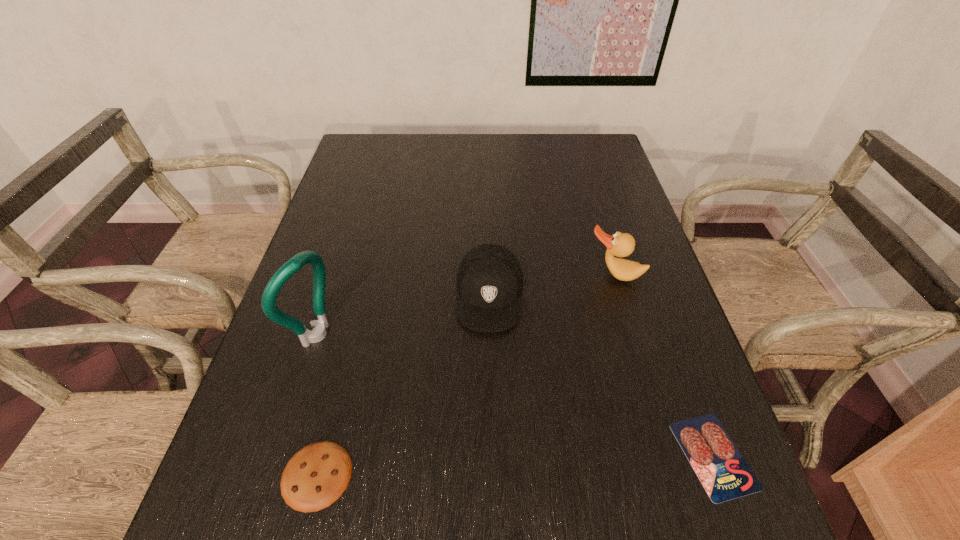
This screenshot has width=960, height=540. Identify the location of the second shortest object. (316, 476).

Locate an element on the screen. This screenshot has width=960, height=540. the shortest object is located at coordinates (x=724, y=473).

Find the location of a particular element. The height and width of the screenshot is (540, 960). bottle opener is located at coordinates (285, 272).

At what (x,y) coordinates should I click in order to perform the action: click on cap. Please return your answer as a coordinate pair (x, y). Image resolution: width=960 pixels, height=540 pixels. Looking at the image, I should click on pos(489,281).

Where is `the third object from left to right`? This screenshot has height=540, width=960. the third object from left to right is located at coordinates (489, 281).

Image resolution: width=960 pixels, height=540 pixels. I want to click on the fourth shortest object, so click(x=620, y=244).

Where is `vacant space situated on the right of the cookie`? The height and width of the screenshot is (540, 960). vacant space situated on the right of the cookie is located at coordinates (450, 475).

The image size is (960, 540). I want to click on blank area located on the back of the shortest object, so click(654, 293).

Identify the location of vacant point located at the jaws of the tallest object. The height and width of the screenshot is (540, 960). (427, 399).

The height and width of the screenshot is (540, 960). In order to click on free space located 0.190m at the jaws of the tallest object in this screenshot , I will do `click(402, 385)`.